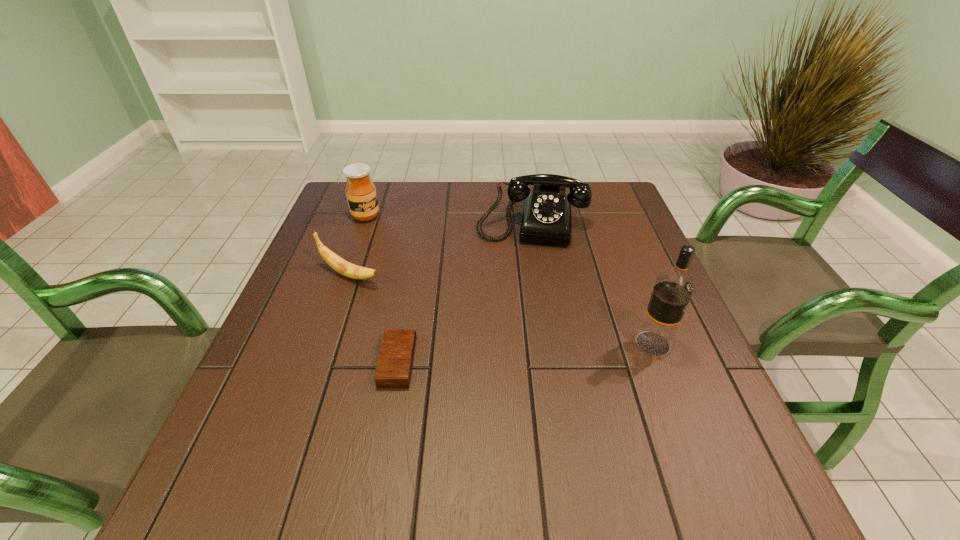
Find the location of a particular element. The image size is (960, 540). the third object from left to right is located at coordinates (394, 367).

Identify the location of alarm clock. Image resolution: width=960 pixels, height=540 pixels. (394, 367).

Locate an element on the screen. Image resolution: width=960 pixels, height=540 pixels. the tallest object is located at coordinates (672, 291).

Find the location of a particular element. The height and width of the screenshot is (540, 960). vodka is located at coordinates (672, 291).

In order to click on the second object from right to left in this screenshot , I will do `click(546, 217)`.

Identify the location of honey. The width and height of the screenshot is (960, 540). pyautogui.click(x=361, y=194).

This screenshot has width=960, height=540. Identify the location of banana. (350, 270).

You are a GUI agent. You are given a task and a screenshot of the screen. Output one action in this format:
    pyautogui.click(x=<x>, y=<y>)
    Task: Click on the second shortest object
    
    Given the screenshot: What is the action you would take?
    (x=350, y=270)

Locate an element on the screen. The width and height of the screenshot is (960, 540). vacant space situated 0.250m on the front face of the shortest object is located at coordinates (538, 362).

At what (x,y) coordinates should I click in order to perform the action: click on vacant space located on the dial of the telephone. Please return your answer as a coordinate pair (x, y). The height and width of the screenshot is (540, 960). Looking at the image, I should click on (517, 325).